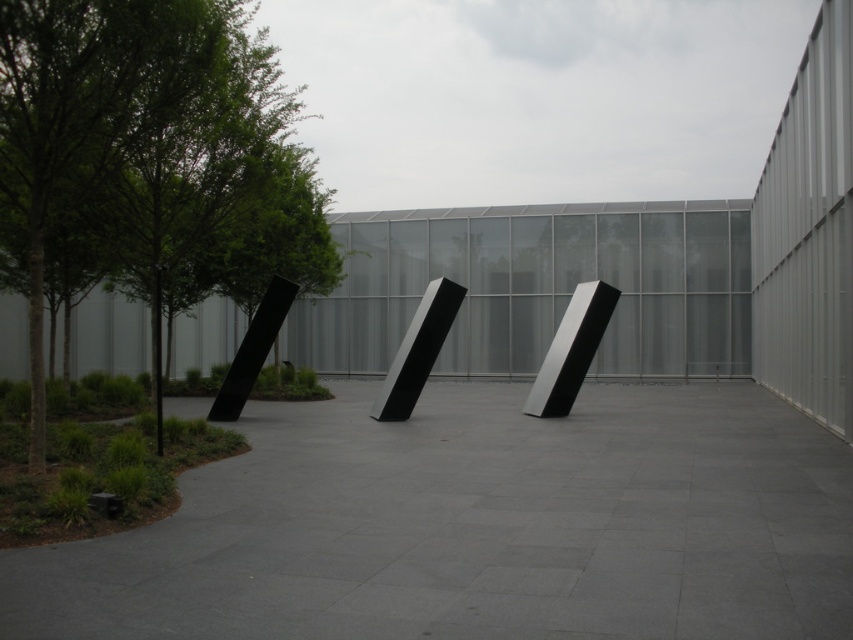
You are standing at the edge of the paved area and want to place a 2.5 meter long sculpture on the gray concrete at center. Can you fit it there?

The gray concrete at center is 3.89 meters away from the camera, but the question is about fitting a 2.5 meter long sculpture. The description only provides distance, not dimensions of the gray concrete. Therefore, it is impossible to determine if the sculpture will fit based on the given information.

You are a landscape architect evaluating the outdoor space. You need to install a new light post that must be taller than the gray concrete at center but shorter than the green leafy tree at left. Is this possible? Please explain.

The gray concrete at center has a lesser height compared to the green leafy tree at left. Therefore, it is possible to install a light post taller than the gray concrete at center but shorter than the green leafy tree at left since there is a height difference between them.